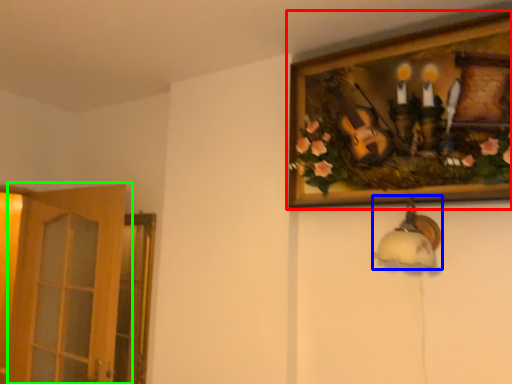
Question: Based on their relative distances, which object is nearer to picture frame (highlighted by a red box)? Choose from lamp (highlighted by a blue box) and door (highlighted by a green box).

Choices:
 (A) lamp
 (B) door

Answer: (A)